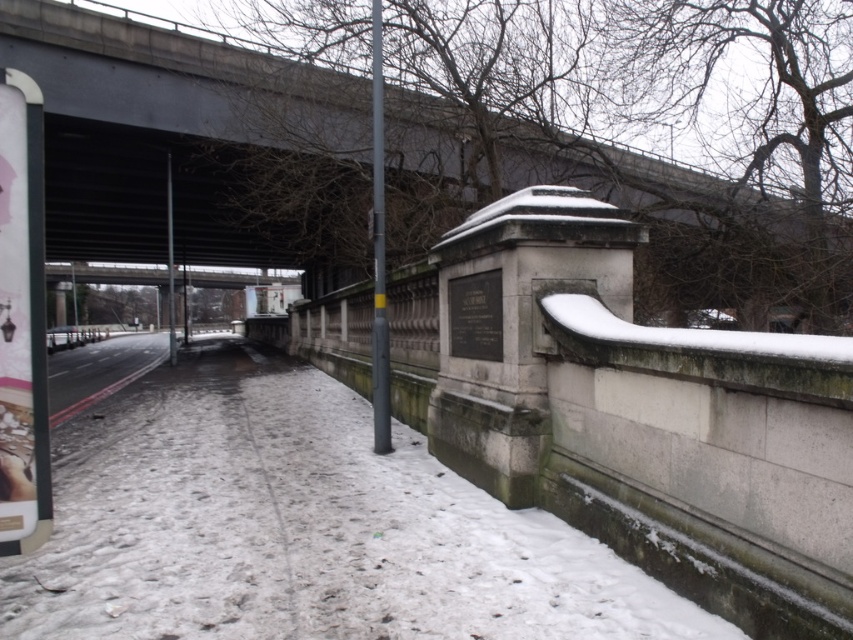
Is concrete bridge at upper center wider than white matte snow at center?

Correct, the width of concrete bridge at upper center exceeds that of white matte snow at center.

Does point (407, 170) come behind point (384, 532)?

Yes, it is.

Where is `concrete bridge at upper center`? concrete bridge at upper center is located at coordinates click(196, 145).

Is the position of white matte snow at center more distant than that of gray stone monument at center?

No, white matte snow at center is in front of gray stone monument at center.

Find the location of a particular element. The image size is (853, 640). white matte snow at center is located at coordinates (300, 529).

Find the location of `white matte snow at center`. white matte snow at center is located at coordinates (300, 529).

Can you confirm if concrete bridge at upper center is bigger than gray stone monument at center?

Indeed, concrete bridge at upper center has a larger size compared to gray stone monument at center.

Does point (683, 282) lie behind point (480, 243)?

Yes, it is.

Which is behind, point (701, 285) or point (523, 417)?

Positioned behind is point (701, 285).

Locate an element on the screen. This screenshot has height=640, width=853. concrete bridge at upper center is located at coordinates (196, 145).